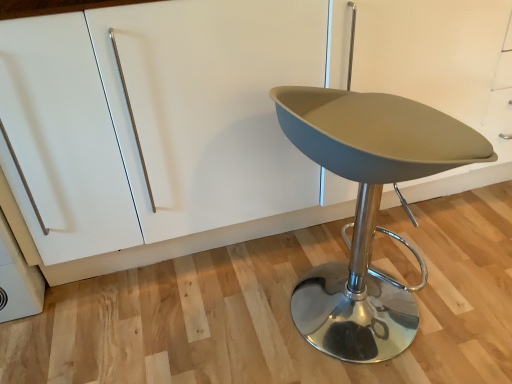
Where is `white matte cabinet at center`? white matte cabinet at center is located at coordinates (439, 72).

This screenshot has width=512, height=384. What do you see at coordinates (439, 72) in the screenshot? I see `white matte cabinet at center` at bounding box center [439, 72].

Describe the element at coordinates (368, 208) in the screenshot. Image resolution: width=512 pixels, height=384 pixels. I see `matte gray stool at center` at that location.

Find the location of a particular element. matte gray stool at center is located at coordinates (368, 208).

Find the location of a particular element. This screenshot has height=384, width=512. white matte cabinet at center is located at coordinates (439, 72).

Between matte gray stool at center and white matte cabinet at center, which one appears on the left side from the viewer's perspective?

white matte cabinet at center.

Is matte gray stool at center positioned behind white matte cabinet at center?

No.

Is point (360, 256) in front of point (446, 173)?

Yes, it is.

From the image's perspective, between matte gray stool at center and white matte cabinet at center, which one is located above?

white matte cabinet at center is shown above in the image.

From a real-world perspective, which is physically above, matte gray stool at center or white matte cabinet at center?

From a 3D spatial view, white matte cabinet at center is above.

Between matte gray stool at center and white matte cabinet at center, which one has smaller width?

Thinner between the two is matte gray stool at center.

Does matte gray stool at center have a greater height compared to white matte cabinet at center?

No, matte gray stool at center is not taller than white matte cabinet at center.

Between matte gray stool at center and white matte cabinet at center, which one has smaller size?

matte gray stool at center is smaller.

Consider the image. Would you say matte gray stool at center is inside or outside white matte cabinet at center?

The correct answer is: outside.

Consider the image. Is matte gray stool at center not near white matte cabinet at center?

No, matte gray stool at center is not far away from white matte cabinet at center.

Is matte gray stool at center facing away from white matte cabinet at center?

No, matte gray stool at center is not facing away from white matte cabinet at center.

This screenshot has height=384, width=512. In order to click on cabinetry that appears above the matte gray stool at center (from the image's perspective) in this screenshot , I will do `click(439, 72)`.

Visually, is white matte cabinet at center positioned to the left or to the right of matte gray stool at center?

Based on their positions, white matte cabinet at center is located to the left of matte gray stool at center.

In the scene shown: Considering their positions, is white matte cabinet at center located in front of or behind matte gray stool at center?

In the image, white matte cabinet at center appears behind matte gray stool at center.

Which point is more distant from viewer, (x=399, y=42) or (x=278, y=106)?

The point (x=399, y=42) is more distant.

From the image's perspective, which is below, white matte cabinet at center or matte gray stool at center?

matte gray stool at center appears lower in the image.

From a real-world perspective, relative to matte gray stool at center, is white matte cabinet at center vertically above or below?

In terms of real-world spatial position, white matte cabinet at center is above matte gray stool at center.

Which object is thinner, white matte cabinet at center or matte gray stool at center?

matte gray stool at center is thinner.

Is white matte cabinet at center taller than matte gray stool at center?

Yes.

Can you confirm if white matte cabinet at center is bigger than matte gray stool at center?

Correct, white matte cabinet at center is larger in size than matte gray stool at center.

Is white matte cabinet at center inside the boundaries of matte gray stool at center, or outside?

white matte cabinet at center lies outside matte gray stool at center.

Is white matte cabinet at center directly adjacent to matte gray stool at center?

white matte cabinet at center is not next to matte gray stool at center, and they're not touching.

Is white matte cabinet at center facing away from matte gray stool at center?

Correct, white matte cabinet at center is looking away from matte gray stool at center.

Can you tell me how much white matte cabinet at center and matte gray stool at center differ in facing direction?

The angle between the facing direction of white matte cabinet at center and the facing direction of matte gray stool at center is 99.2 degrees.

I want to click on cabinetry positioned vertically above the matte gray stool at center (from a real-world perspective), so click(439, 72).

The height and width of the screenshot is (384, 512). I want to click on furniture directly beneath the white matte cabinet at center (from a real-world perspective), so click(368, 208).

Image resolution: width=512 pixels, height=384 pixels. What are the coordinates of `furniture in front of the white matte cabinet at center` in the screenshot? It's located at (368, 208).